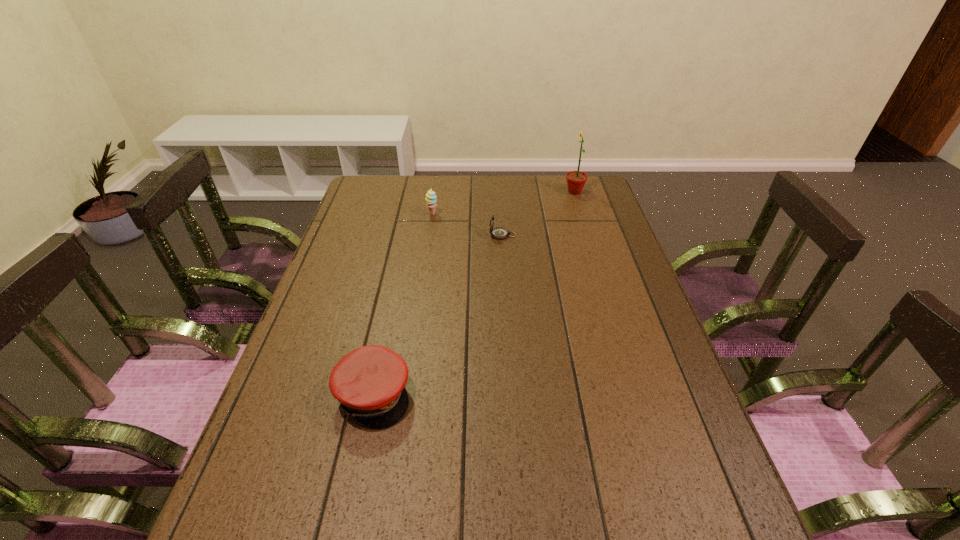
Identify the location of free space located on the back of the third nearest object. (438, 180).

The width and height of the screenshot is (960, 540). Find the location of `free region located 0.330m on the face of the third object from left to right`. free region located 0.330m on the face of the third object from left to right is located at coordinates (389, 235).

Find the location of a particular element. The image size is (960, 540). free location located on the face of the third object from left to right is located at coordinates (425, 235).

The width and height of the screenshot is (960, 540). Find the location of `vacant area situated 0.230m on the face of the third object from left to right`. vacant area situated 0.230m on the face of the third object from left to right is located at coordinates (419, 235).

At what (x,y) coordinates should I click in order to perform the action: click on free spot located 0.320m on the front-facing side of the cap. Please return your answer as a coordinate pair (x, y). Looking at the image, I should click on (554, 395).

This screenshot has width=960, height=540. Identify the location of object that is positioned at the far edge. (576, 180).

This screenshot has width=960, height=540. In order to click on object at the left edge in this screenshot , I will do `click(369, 382)`.

Find the location of a particular element. object positioned at the right edge is located at coordinates [576, 180].

Locate an element on the screen. object that is at the far right corner is located at coordinates 576,180.

Locate an element on the screen. vacant area at the far edge is located at coordinates (417, 189).